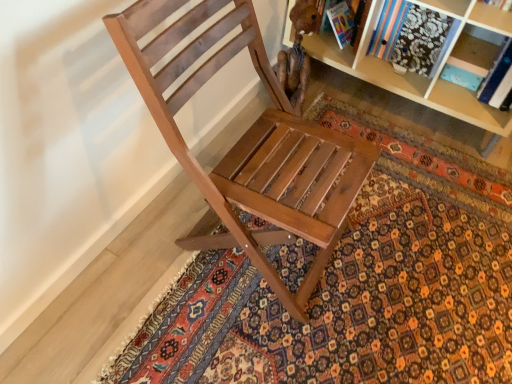
This screenshot has width=512, height=384. What do you see at coordinates (247, 143) in the screenshot?
I see `wooden chair at center` at bounding box center [247, 143].

The height and width of the screenshot is (384, 512). In order to click on wooden chair at center in this screenshot , I will do `click(247, 143)`.

What is the approximate height of wooden chair at center?

It is 32.06 inches.

Find the location of a particular element. patterned carpet at center is located at coordinates (356, 286).

What is the approximate width of patterned carpet at center?

The width of patterned carpet at center is 5.09 feet.

In order to face patterned carpet at center, should I rotate leftwards or rightwards?

Rotate your view right by about 14.675°.

Describe the element at coordinates (356, 286) in the screenshot. I see `patterned carpet at center` at that location.

The height and width of the screenshot is (384, 512). What are the coordinates of `wooden chair at center` in the screenshot? It's located at (247, 143).

Considering the relative positions of wooden chair at center and patterned carpet at center in the image provided, is wooden chair at center to the left of patterned carpet at center from the viewer's perspective?

Correct, you'll find wooden chair at center to the left of patterned carpet at center.

Is wooden chair at center positioned behind patterned carpet at center?

No, it is in front of patterned carpet at center.

Is point (184, 69) more distant than point (405, 173)?

No, it is in front of (405, 173).

From the image's perspective, relative to patterned carpet at center, is wooden chair at center above or below?

Clearly, from the image's perspective, wooden chair at center is above patterned carpet at center.

From a real-world perspective, which object rests below the other?

patterned carpet at center, from a real-world perspective.

Is wooden chair at center wider or thinner than patterned carpet at center?

In the image, wooden chair at center appears to be more narrow than patterned carpet at center.

From the picture: Who is shorter, wooden chair at center or patterned carpet at center?

patterned carpet at center is shorter.

Who is smaller, wooden chair at center or patterned carpet at center?

With smaller size is patterned carpet at center.

Could patterned carpet at center be considered to be inside wooden chair at center?

No, patterned carpet at center is located outside of wooden chair at center.

Is wooden chair at center with patterned carpet at center?

There is a gap between wooden chair at center and patterned carpet at center.

Does wooden chair at center turn towards patterned carpet at center?

Yes, wooden chair at center faces towards patterned carpet at center.

How different are the orientations of wooden chair at center and patterned carpet at center in degrees?

91.6 degrees separate the facing orientations of wooden chair at center and patterned carpet at center.

Image resolution: width=512 pixels, height=384 pixels. In order to click on doormat behind the wooden chair at center in this screenshot , I will do `click(356, 286)`.

Which is more to the left, patterned carpet at center or wooden chair at center?

From the viewer's perspective, wooden chair at center appears more on the left side.

Is the depth of patterned carpet at center less than that of wooden chair at center?

No, it is behind wooden chair at center.

Between point (482, 261) and point (264, 272), which one is positioned in front?

The point (264, 272) is in front.

From the image's perspective, is patterned carpet at center beneath wooden chair at center?

Yes, from the image's perspective, patterned carpet at center is beneath wooden chair at center.

From a real-world perspective, which object stands above the other?

wooden chair at center, from a real-world perspective.

Looking at their sizes, would you say patterned carpet at center is wider or thinner than wooden chair at center?

In the image, patterned carpet at center appears to be wider than wooden chair at center.

Can you confirm if patterned carpet at center is taller than wooden chair at center?

No, patterned carpet at center is not taller than wooden chair at center.

Does patterned carpet at center have a smaller size compared to wooden chair at center?

Yes, patterned carpet at center is smaller than wooden chair at center.

Can wooden chair at center be found inside patterned carpet at center?

No, wooden chair at center is not inside patterned carpet at center.

Looking at this image, is there a large distance between patterned carpet at center and wooden chair at center?

That's not correct — patterned carpet at center is a little close to wooden chair at center.

Is wooden chair at center at the back of patterned carpet at center?

patterned carpet at center is not turned away from wooden chair at center.

Based on the photo, can you tell me how much patterned carpet at center and wooden chair at center differ in facing direction?

patterned carpet at center and wooden chair at center are facing 91.6 degrees away from each other.

At what (x,y) coordinates should I click in order to perform the action: click on chair above the patterned carpet at center (from the image's perspective). Please return your answer as a coordinate pair (x, y). This screenshot has height=384, width=512. Looking at the image, I should click on (247, 143).

Image resolution: width=512 pixels, height=384 pixels. Identify the location of chair that appears on the left of patterned carpet at center. (247, 143).

Where is `doormat on the right side of wooden chair at center`? The width and height of the screenshot is (512, 384). doormat on the right side of wooden chair at center is located at coordinates (356, 286).